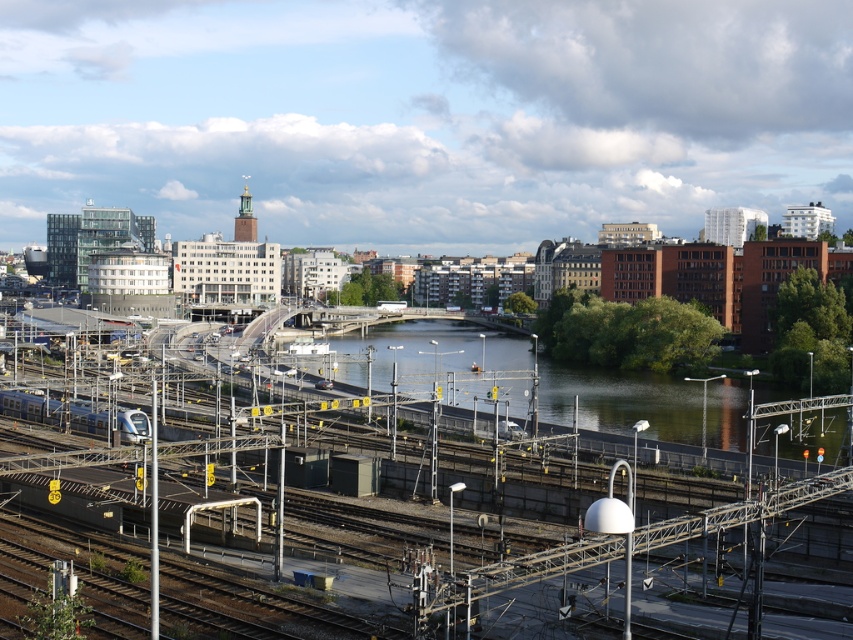
Is green water at center further to the viewer compared to silver metallic train at lower left?

That is False.

Which of these two, green water at center or silver metallic train at lower left, stands shorter?

With less height is silver metallic train at lower left.

Is point (396, 330) positioned in front of point (132, 413)?

No, (396, 330) is behind (132, 413).

Where is `green water at center`? green water at center is located at coordinates (619, 401).